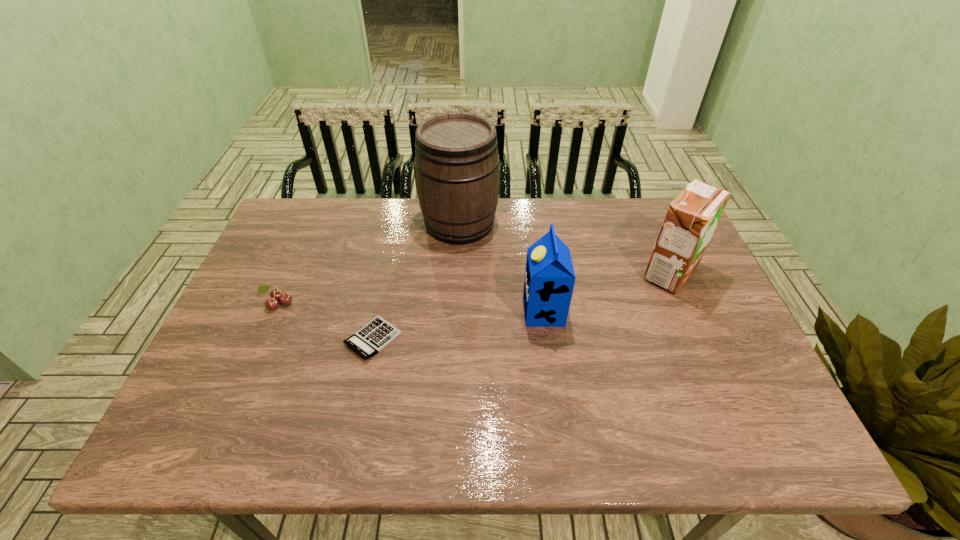
Identify the location of free space between the rightmost object and the cherry. This screenshot has width=960, height=540. (474, 288).

Locate an element on the screen. unoccupied position between the shortest object and the fourth object from left to right is located at coordinates (458, 325).

What are the coordinates of `free space between the fourth object from right to left and the right carton` in the screenshot? It's located at (521, 306).

Image resolution: width=960 pixels, height=540 pixels. I want to click on unoccupied area between the fourth object from right to left and the fourth object from left to right, so click(458, 325).

At what (x,y) coordinates should I click in order to perform the action: click on free space between the leftmost object and the right carton. Please return your answer as a coordinate pair (x, y). This screenshot has width=960, height=540. Looking at the image, I should click on (474, 288).

Where is `unoccupied position between the nearer carton and the farthest object`? Image resolution: width=960 pixels, height=540 pixels. unoccupied position between the nearer carton and the farthest object is located at coordinates (501, 267).

This screenshot has width=960, height=540. In order to click on free point between the second shortest object and the rightmost object in this screenshot , I will do `click(474, 288)`.

Choose which object is the second nearest neighbor to the cherry. Please provide its 2D coordinates. Your answer should be formatted as a tuple, i.e. [(x, y)], where the tuple contains the x and y coordinates of a point satisfying the conditions above.

[(456, 153)]

Identify which object is the closest to the farther carton. Please provide its 2D coordinates. Your answer should be formatted as a tuple, i.e. [(x, y)], where the tuple contains the x and y coordinates of a point satisfying the conditions above.

[(549, 281)]

Find the location of a particular element. blank space that satisfies the following two spatial constraints: 1. with the cap open on the nearer carton; 2. on the front side of the second object from left to right is located at coordinates pyautogui.click(x=547, y=339).